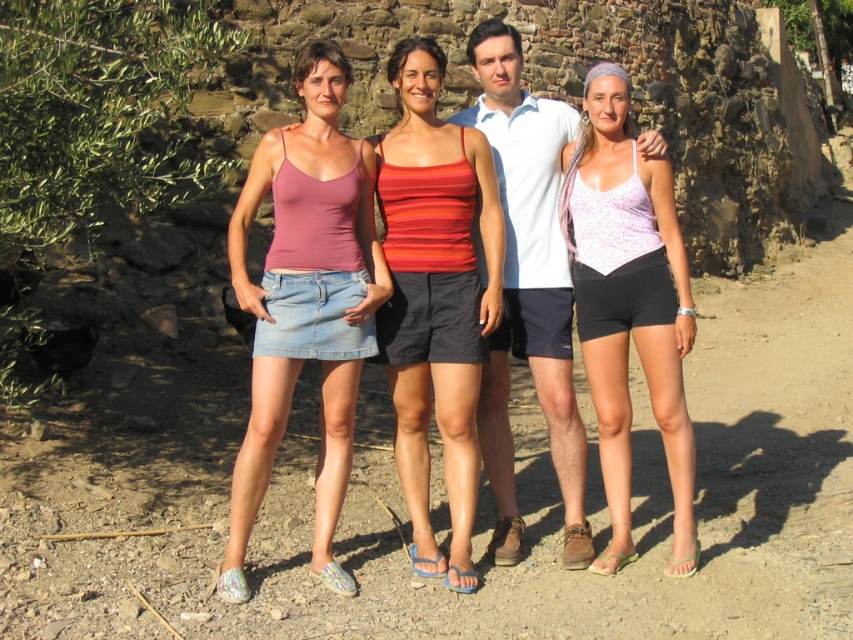
Which is more to the right, pink denim skirt at lower left or striped cotton tank top at center?

striped cotton tank top at center

Between point (460, 221) and point (498, 214), which one is positioned behind?

Point (498, 214)

Where is `pink denim skirt at lower left`? This screenshot has width=853, height=640. pink denim skirt at lower left is located at coordinates (433, 296).

Locate an element on the screen. The image size is (853, 640). pink denim skirt at lower left is located at coordinates (433, 296).

Is pink denim skirt at lower left bigger than purple floral tank top at center?

Correct, pink denim skirt at lower left is larger in size than purple floral tank top at center.

Find the location of `pink denim skirt at lower left`. pink denim skirt at lower left is located at coordinates (433, 296).

Between purple floral tank top at center and white cotton shirt at center, which one has more height?

Standing taller between the two is white cotton shirt at center.

Can you confirm if purple floral tank top at center is taller than white cotton shirt at center?

No, purple floral tank top at center is not taller than white cotton shirt at center.

Which is in front, point (665, 211) or point (556, 433)?

Positioned in front is point (665, 211).

The width and height of the screenshot is (853, 640). Find the location of `purple floral tank top at center`. purple floral tank top at center is located at coordinates (630, 304).